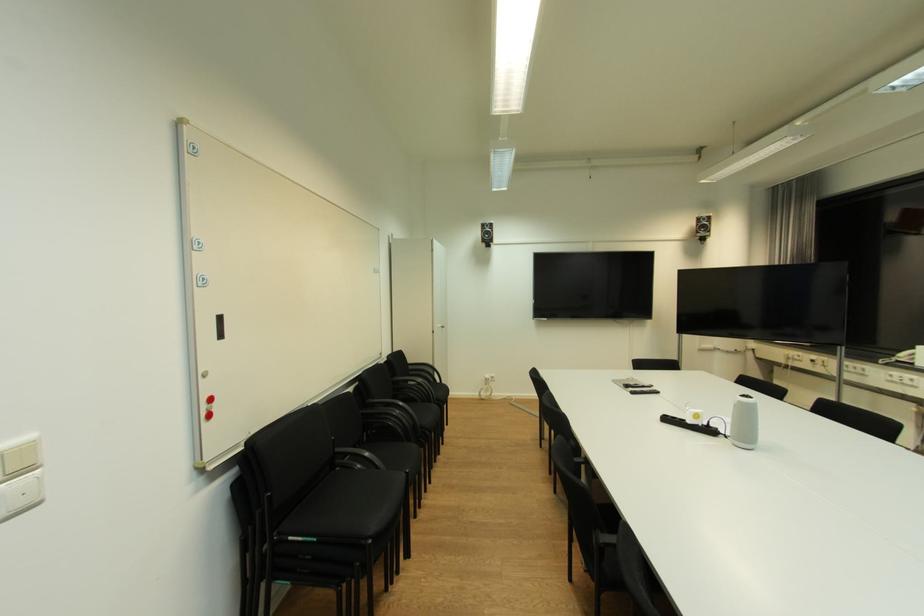
What do you see at coordinates (371, 454) in the screenshot? This screenshot has height=616, width=924. I see `the chair armrest` at bounding box center [371, 454].